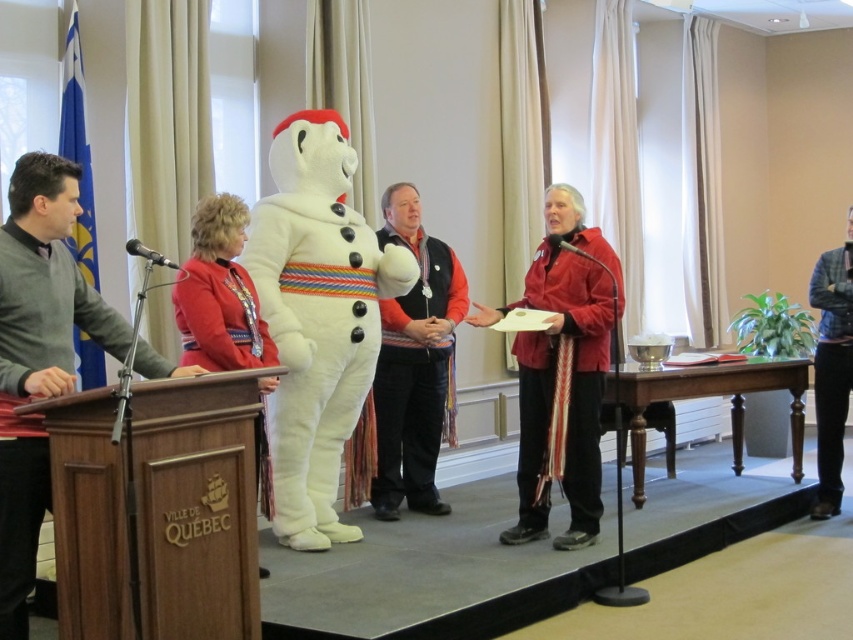
Question: Can you confirm if velvet-like vest at center is bigger than blue corduroy jacket at right?

Choices:
 (A) yes
 (B) no

Answer: (A)

Question: Which point is closer to the camera?

Choices:
 (A) (527, 433)
 (B) (787, 376)
 (C) (838, 326)
 (D) (223, 262)

Answer: (D)

Question: In this image, where is white plush snowman at center located relative to blue corduroy jacket at right?

Choices:
 (A) right
 (B) left

Answer: (B)

Question: Which object appears closest to the camera in this image?

Choices:
 (A) brown wood podium at left
 (B) white plush snowman at center
 (C) blue corduroy jacket at right
 (D) red matte jacket at center

Answer: (A)

Question: Can you confirm if brown wood podium at left is positioned below wooden podium at center?

Choices:
 (A) yes
 (B) no

Answer: (B)

Question: Which object appears farthest from the camera in this image?

Choices:
 (A) brown wood podium at left
 (B) velvet-like vest at center
 (C) red fabric jacket at center

Answer: (B)